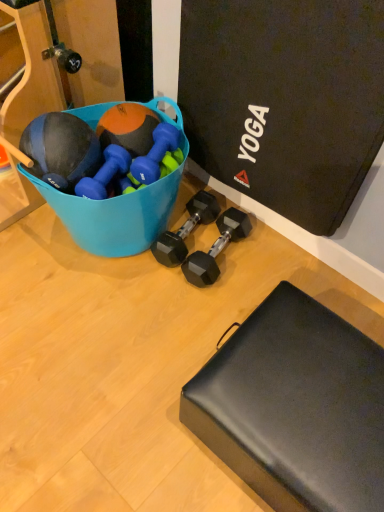
Question: Is black matte footrest at lower right positioned beyond the bounds of blue plastic bucket at upper left?

Choices:
 (A) yes
 (B) no

Answer: (A)

Question: Are black matte footrest at lower right and blue plastic bucket at upper left making contact?

Choices:
 (A) yes
 (B) no

Answer: (B)

Question: From a real-world perspective, is black matte footrest at lower right located beneath blue plastic bucket at upper left?

Choices:
 (A) no
 (B) yes

Answer: (B)

Question: Does black matte footrest at lower right have a greater height compared to blue plastic bucket at upper left?

Choices:
 (A) yes
 (B) no

Answer: (B)

Question: Does black matte footrest at lower right lie behind blue plastic bucket at upper left?

Choices:
 (A) yes
 (B) no

Answer: (B)

Question: Is point (211, 218) positioned closer to the camera than point (142, 178)?

Choices:
 (A) farther
 (B) closer

Answer: (A)

Question: Would you say black rubber dumbbell at center, arranged as the 2th dumbbell when viewed from the right, is inside or outside blue rubber dumbbell at center, which appears as the 3th dumbbell when viewed from the right?

Choices:
 (A) outside
 (B) inside

Answer: (A)

Question: From the image's perspective, is black rubber dumbbell at center, which ranks as the third dumbbell in left-to-right order, located above or below blue rubber dumbbell at center, which appears as the 3th dumbbell when viewed from the right?

Choices:
 (A) below
 (B) above

Answer: (A)

Question: From a real-world perspective, is black rubber dumbbell at center, which ranks as the third dumbbell in left-to-right order, positioned above or below blue rubber dumbbell at center, which appears as the 3th dumbbell when viewed from the right?

Choices:
 (A) above
 (B) below

Answer: (B)

Question: Is blue rubber dumbbell at center, which appears as the 3th dumbbell when viewed from the right, in front of or behind black matte footrest at lower right in the image?

Choices:
 (A) behind
 (B) front

Answer: (A)

Question: From a real-world perspective, is blue rubber dumbbell at center, which ranks as the second dumbbell in left-to-right order, positioned above or below black matte footrest at lower right?

Choices:
 (A) above
 (B) below

Answer: (A)

Question: Does point pyautogui.click(x=172, y=143) appear closer or farther from the camera than point pyautogui.click(x=299, y=349)?

Choices:
 (A) farther
 (B) closer

Answer: (A)

Question: Visually, is blue rubber dumbbell at center, which appears as the 3th dumbbell when viewed from the right, positioned to the left or to the right of black matte footrest at lower right?

Choices:
 (A) right
 (B) left

Answer: (B)

Question: Visually, is black matte footrest at lower right positioned to the left or to the right of blue rubber dumbbell at center, which ranks as the second dumbbell in left-to-right order?

Choices:
 (A) right
 (B) left

Answer: (A)

Question: In terms of width, does black matte footrest at lower right look wider or thinner when compared to blue rubber dumbbell at center, which appears as the 3th dumbbell when viewed from the right?

Choices:
 (A) wide
 (B) thin

Answer: (A)